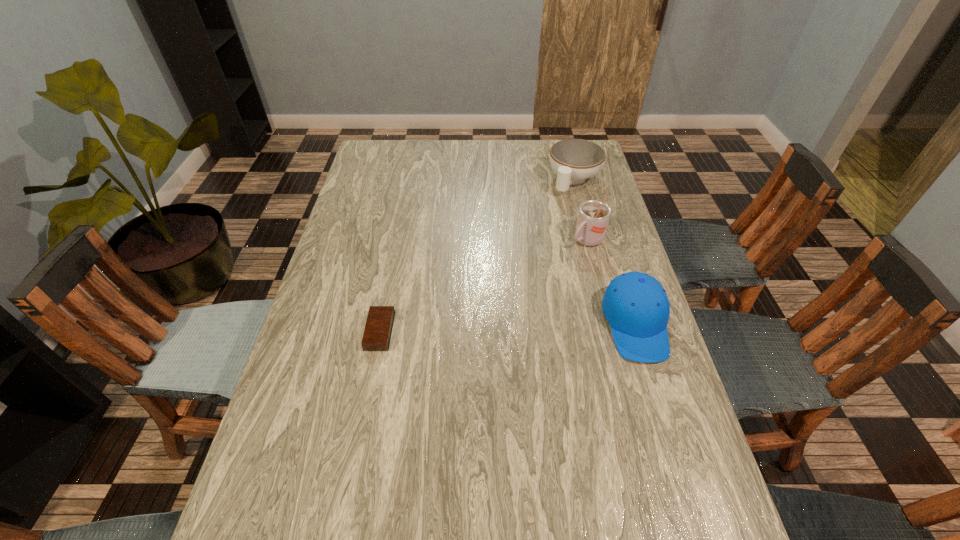
What are the coordinates of `vacant spot on the desktop that is between the shortest object and the cap and is positioned on the side with the handle of the cup` in the screenshot? It's located at (479, 329).

The image size is (960, 540). I want to click on vacant space on the desktop that is between the alarm clock and the cap and is positioned on the side with the handle of the farthest object, so click(470, 329).